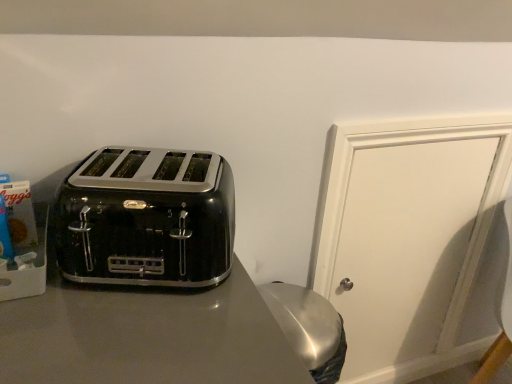
This screenshot has height=384, width=512. I want to click on free location above white matte door at center (from a real-world perspective), so click(434, 112).